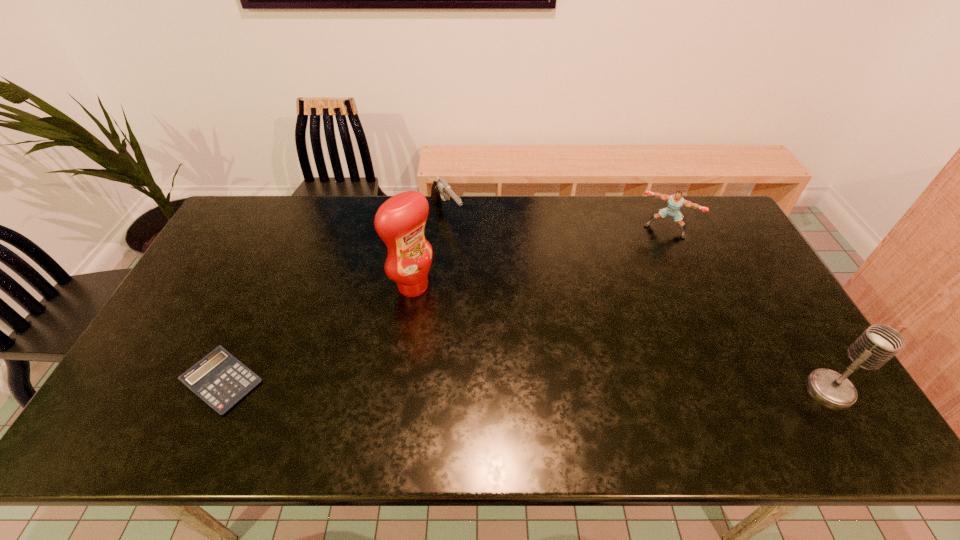
Where is `free space located on the front-facing side of the fourth object from left to right`? free space located on the front-facing side of the fourth object from left to right is located at coordinates (639, 275).

I want to click on vacant space situated on the front-facing side of the fourth object from left to right, so click(636, 284).

Image resolution: width=960 pixels, height=540 pixels. Find the location of `free region located 0.160m on the front-facing side of the fourth object from left to right`. free region located 0.160m on the front-facing side of the fourth object from left to right is located at coordinates (643, 268).

In order to click on vacant point located 0.250m on the label side of the tallest object in this screenshot , I will do `click(492, 345)`.

This screenshot has width=960, height=540. What are the coordinates of `blank area located on the label side of the tallest object` in the screenshot? It's located at (503, 354).

In order to click on free location located 0.110m on the label side of the tallest object in this screenshot , I will do `click(454, 318)`.

The width and height of the screenshot is (960, 540). I want to click on vacant space located at the muzzle of the gun, so click(497, 277).

Locate an element on the screen. vacant space located 0.290m at the muzzle of the gun is located at coordinates (501, 281).

Where is `free point located 0.190m at the muzzle of the gun`? free point located 0.190m at the muzzle of the gun is located at coordinates (484, 262).

You are a GUI agent. You are given a task and a screenshot of the screen. Output one action in this format:
    pyautogui.click(x=<x>, y=<y>)
    Task: Click on the puncher present at the far edge
    
    Given the screenshot: What is the action you would take?
    pyautogui.click(x=675, y=202)